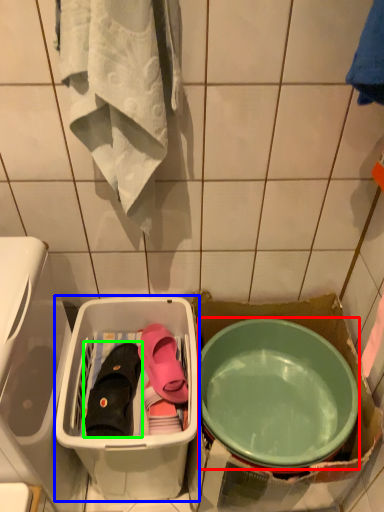
Question: Based on their relative distances, which object is farther from mixing bowl (highlighted by a red box)? Choose from storage box (highlighted by a blue box) and footwear (highlighted by a green box).

Choices:
 (A) storage box
 (B) footwear

Answer: (B)